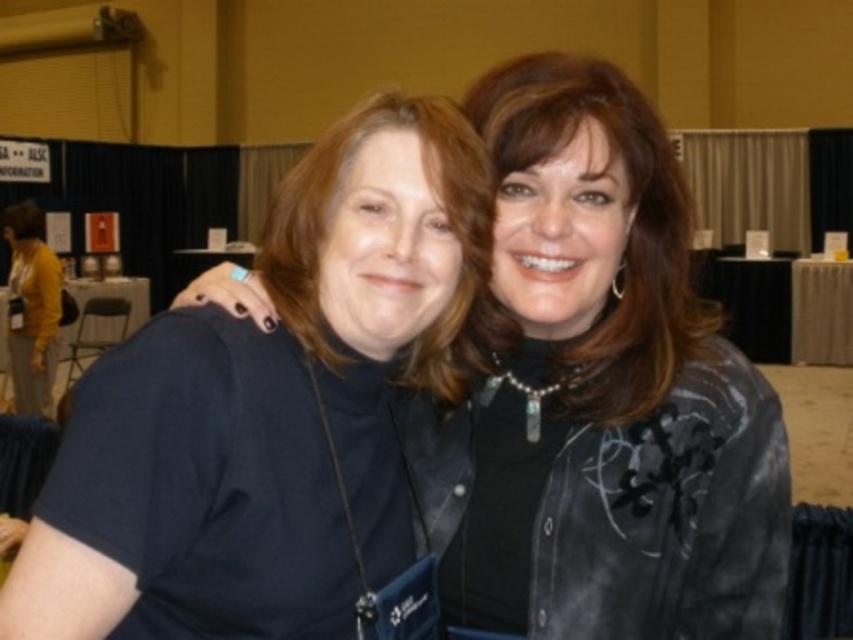
Between matte black jacket at center and black fabric shirt at center, which one appears on the left side from the viewer's perspective?

Positioned to the left is black fabric shirt at center.

Who is more forward, (566, 548) or (384, 550)?

Point (566, 548) is more forward.

What do you see at coordinates (604, 390) in the screenshot? This screenshot has width=853, height=640. I see `matte black jacket at center` at bounding box center [604, 390].

Locate an element on the screen. The height and width of the screenshot is (640, 853). matte black jacket at center is located at coordinates click(604, 390).